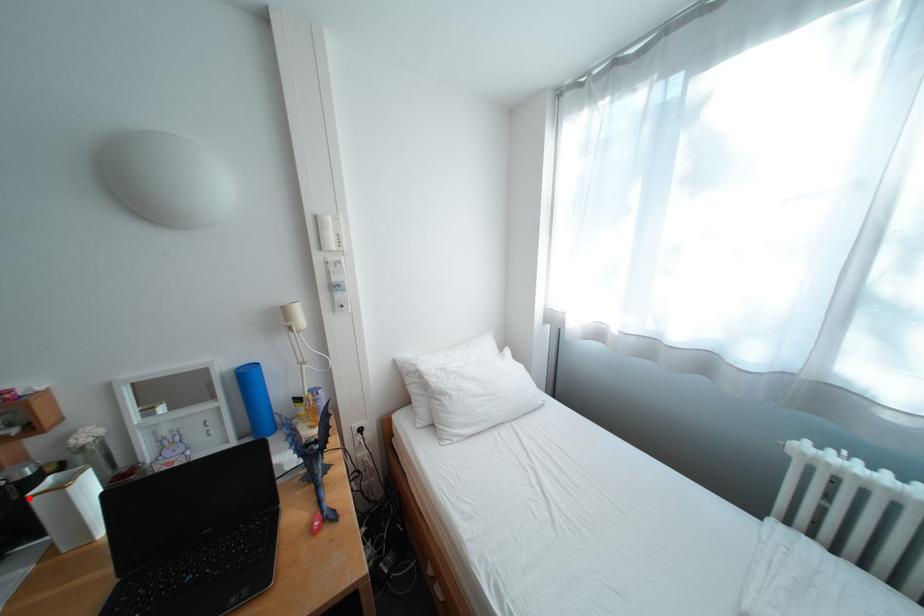
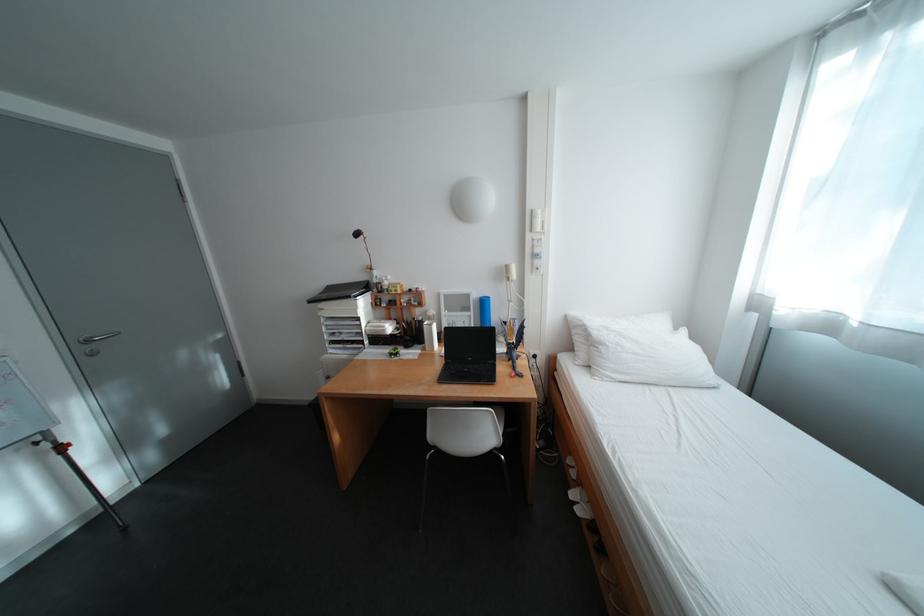
Question: I am providing you with two images of the same scene from different viewpoints. In image1, a red point is highlighted. Considering the same 3D point in image2, which of the following is correct?

Choices:
 (A) It is closer
 (B) It is farther

Answer: (B)